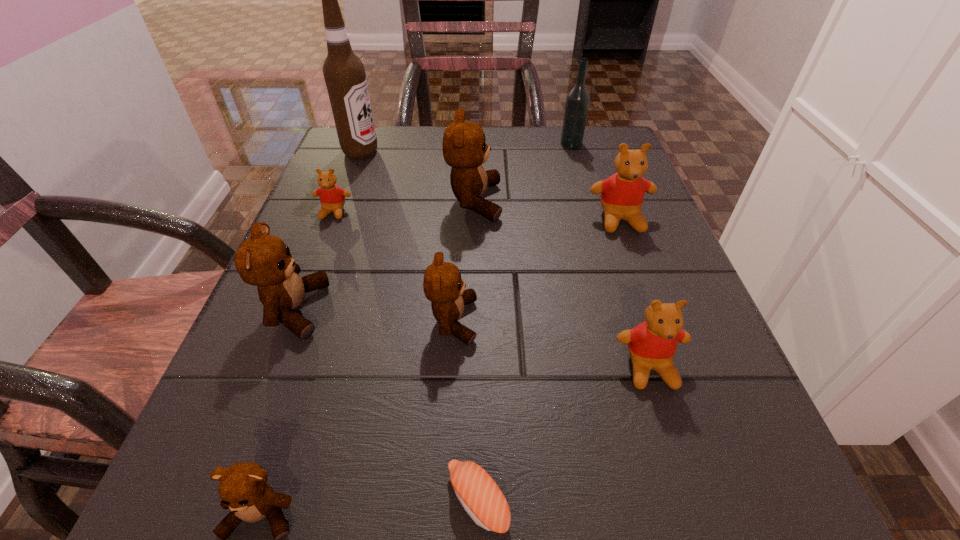
Find the location of `alcohol present at the far edge`. alcohol present at the far edge is located at coordinates (344, 73).

Identify the location of vodka at the far edge. (577, 101).

You are a GUI agent. You are given a task and a screenshot of the screen. Output one action in this format:
    pyautogui.click(x=<x>, y=<y>)
    Task: Click on the object that is positioned at the near edge
    The image size is (960, 540).
    Given the screenshot: What is the action you would take?
    pyautogui.click(x=480, y=496)

This screenshot has height=540, width=960. Find the location of `alcohol present at the left edge`. alcohol present at the left edge is located at coordinates (344, 73).

Identify the location of vodka situated at the right edge. Image resolution: width=960 pixels, height=540 pixels. (577, 101).

Locate an element on the screen. object positioned at the far left corner is located at coordinates (344, 73).

In order to click on object located in the far right corner section of the desktop in this screenshot , I will do `click(577, 101)`.

Where is `vacant space at the far edge`? Image resolution: width=960 pixels, height=540 pixels. vacant space at the far edge is located at coordinates (548, 177).

The height and width of the screenshot is (540, 960). What are the coordinates of `vacant space at the near edge of the desktop` in the screenshot? It's located at point(385,486).

Where is `vacant space at the left edge of the desktop`? This screenshot has width=960, height=540. vacant space at the left edge of the desktop is located at coordinates (340, 328).